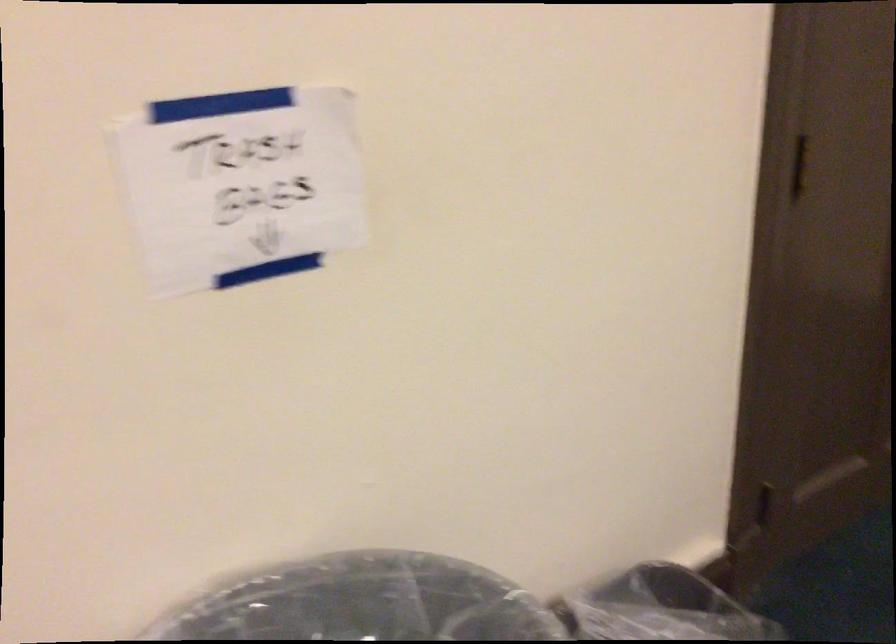
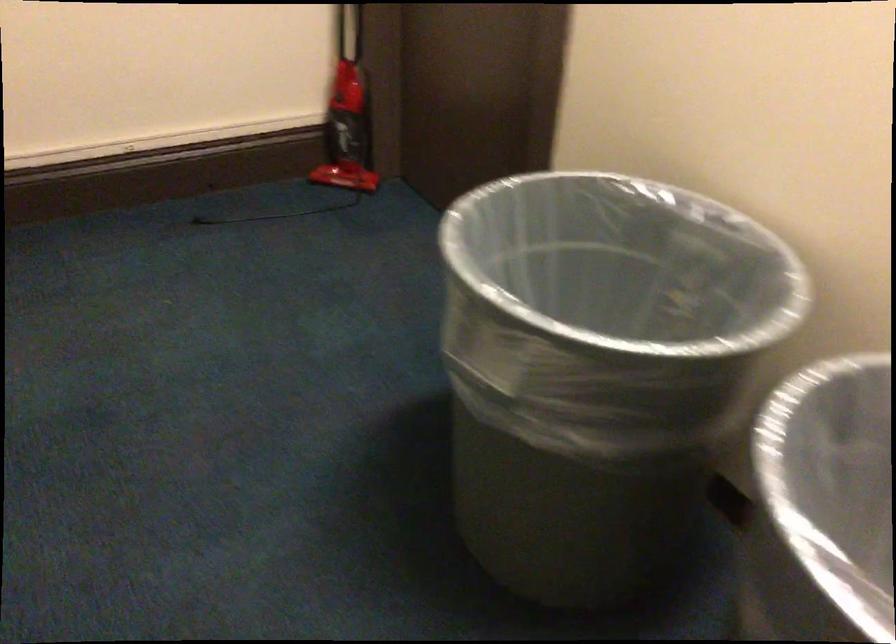
First-person continuous shooting, in which direction is the camera rotating?

The camera rotated toward right-down.